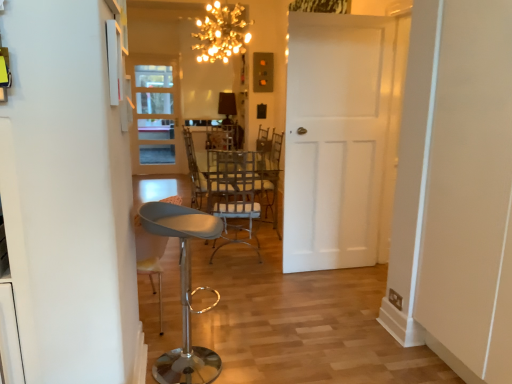
Question: From the image's perspective, does metallic silver chair at center appear higher than metallic gray stool at lower left?

Choices:
 (A) no
 (B) yes

Answer: (B)

Question: Does metallic silver chair at center have a lesser width compared to metallic gray stool at lower left?

Choices:
 (A) yes
 (B) no

Answer: (B)

Question: From the image's perspective, would you say metallic silver chair at center is shown under metallic gray stool at lower left?

Choices:
 (A) yes
 (B) no

Answer: (B)

Question: Considering the relative sizes of metallic silver chair at center and metallic gray stool at lower left in the image provided, is metallic silver chair at center bigger than metallic gray stool at lower left?

Choices:
 (A) yes
 (B) no

Answer: (A)

Question: Is metallic silver chair at center at the left side of metallic gray stool at lower left?

Choices:
 (A) yes
 (B) no

Answer: (B)

Question: Is metallic woven chair at center to the left or to the right of white matte door at center, the 2th door viewed from the back, in the image?

Choices:
 (A) right
 (B) left

Answer: (B)

Question: In the image, is metallic woven chair at center positioned in front of or behind white matte door at center, the 2th door viewed from the back?

Choices:
 (A) behind
 (B) front

Answer: (A)

Question: From a real-world perspective, is metallic woven chair at center positioned above or below white matte door at center, acting as the second door starting from the left?

Choices:
 (A) above
 (B) below

Answer: (B)

Question: Does point (236, 185) appear closer or farther from the camera than point (308, 269)?

Choices:
 (A) closer
 (B) farther

Answer: (B)

Question: In terms of width, does white glass door at left, which is the 2th door from right to left, look wider or thinner when compared to metallic gray stool at lower left?

Choices:
 (A) wide
 (B) thin

Answer: (B)

Question: Considering the positions of white glass door at left, arranged as the 1th door when viewed from the left, and metallic gray stool at lower left in the image, is white glass door at left, arranged as the 1th door when viewed from the left, taller or shorter than metallic gray stool at lower left?

Choices:
 (A) short
 (B) tall

Answer: (B)

Question: Is white glass door at left, which is the 2th door from right to left, bigger or smaller than metallic gray stool at lower left?

Choices:
 (A) big
 (B) small

Answer: (A)

Question: Considering the positions of point (169, 140) and point (197, 352), is point (169, 140) closer or farther from the camera than point (197, 352)?

Choices:
 (A) farther
 (B) closer

Answer: (A)

Question: Considering their positions, is metallic woven chair at center located in front of or behind metallic silver chair at center?

Choices:
 (A) behind
 (B) front

Answer: (A)

Question: Choose the correct answer: Is metallic woven chair at center inside metallic silver chair at center or outside it?

Choices:
 (A) outside
 (B) inside

Answer: (A)